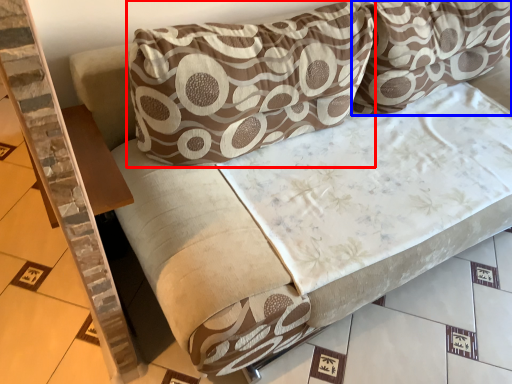
Question: Among these objects, which one is nearest to the camera, pillow (highlighted by a red box) or pillow (highlighted by a blue box)?

Choices:
 (A) pillow
 (B) pillow

Answer: (A)